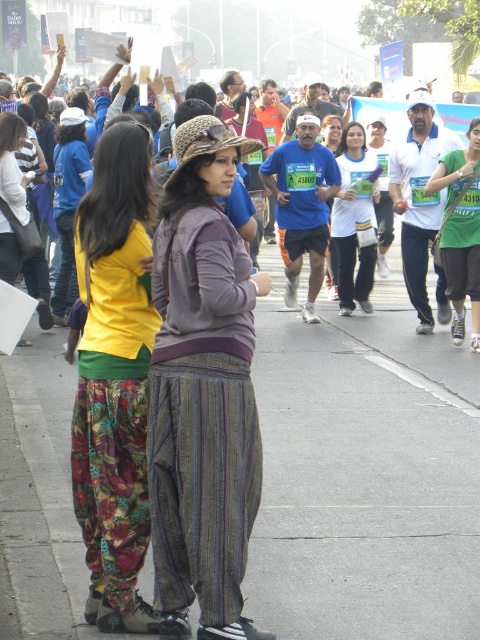
From the picture: Who is more distant from viewer, [95,378] or [312,316]?

Positioned behind is point [312,316].

Which is more to the left, floral pants at center or blue fabric shirt at center?

floral pants at center is more to the left.

Find the location of a particular element. Image resolution: width=480 pixels, height=640 pixels. floral pants at center is located at coordinates (115, 378).

Is floral pants at center further to camera compared to green fabric shirt at center?

No, it is not.

Between floral pants at center and green fabric shirt at center, which one appears on the right side from the viewer's perspective?

From the viewer's perspective, green fabric shirt at center appears more on the right side.

Who is more forward, (118, 531) or (447, 216)?

Point (118, 531) is in front.

In order to click on floral pants at center in this screenshot , I will do `click(115, 378)`.

Which of these two, blue fabric shirt at center or white matte shirt at center, stands taller?

With more height is blue fabric shirt at center.

Does blue fabric shirt at center come behind white matte shirt at center?

No, it is in front of white matte shirt at center.

Does point (288, 262) come in front of point (338, 225)?

Yes, it is.

Find the location of a particular element. Image resolution: width=480 pixels, height=640 pixels. blue fabric shirt at center is located at coordinates (x=301, y=205).